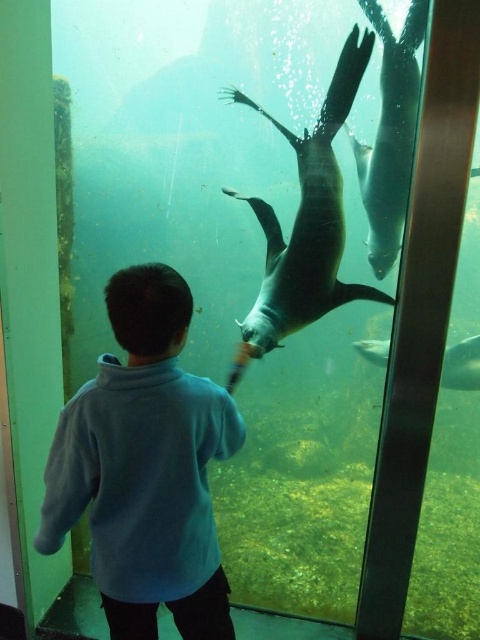
Question: Which point appears farthest from the camera in this image?

Choices:
 (A) (408, 144)
 (B) (386, 355)
 (C) (314, 224)

Answer: (B)

Question: Is gray matte penguin at upper right above shiny silver fish at center?

Choices:
 (A) yes
 (B) no

Answer: (A)

Question: In this image, where is gray matte penguin at upper right located relative to shiny silver fish at center?

Choices:
 (A) left
 (B) right

Answer: (A)

Question: Is blue fleece jacket at center thinner than smooth gray penguin at center?

Choices:
 (A) no
 (B) yes

Answer: (B)

Question: Among these points, which one is nearest to the camera?

Choices:
 (A) (332, 209)
 (B) (465, 364)
 (C) (383, 220)
 (D) (203, 580)

Answer: (D)

Question: Which of the following is the farthest from the observer?

Choices:
 (A) (163, 387)
 (B) (445, 352)
 (C) (385, 164)

Answer: (B)